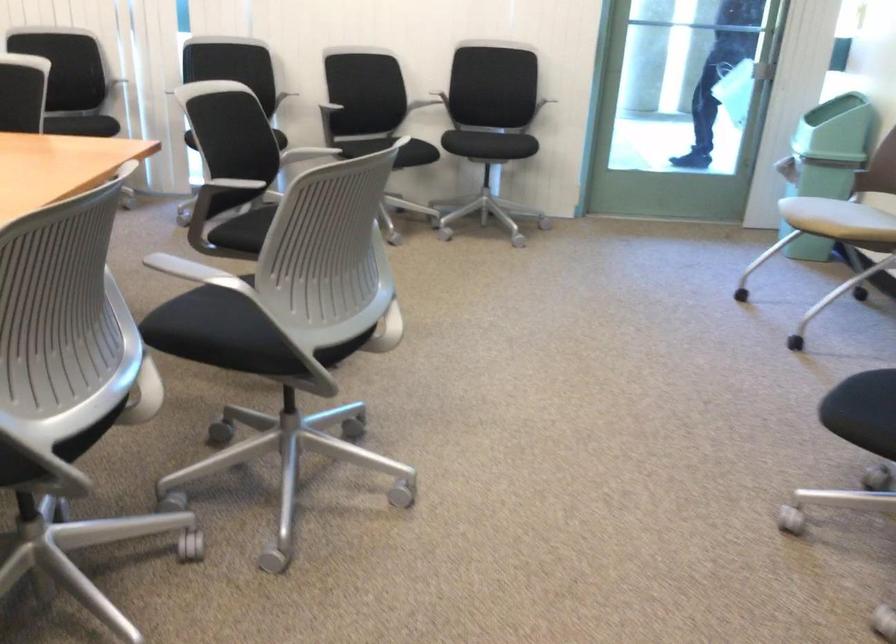
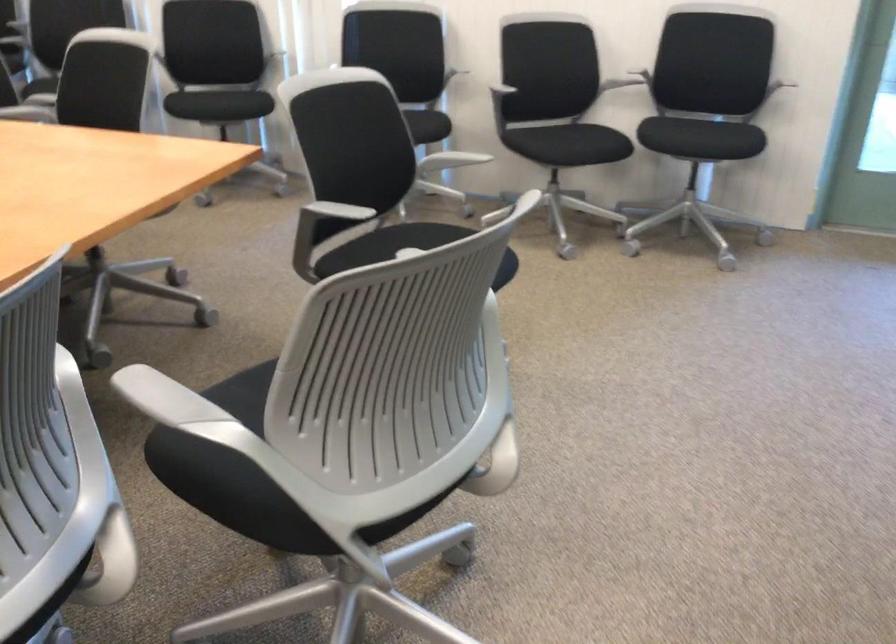
Question: The images are taken continuously from a first-person perspective. In which direction is your viewpoint rotating?

Choices:
 (A) Left
 (B) Right
 (C) Up
 (D) Down

Answer: (A)